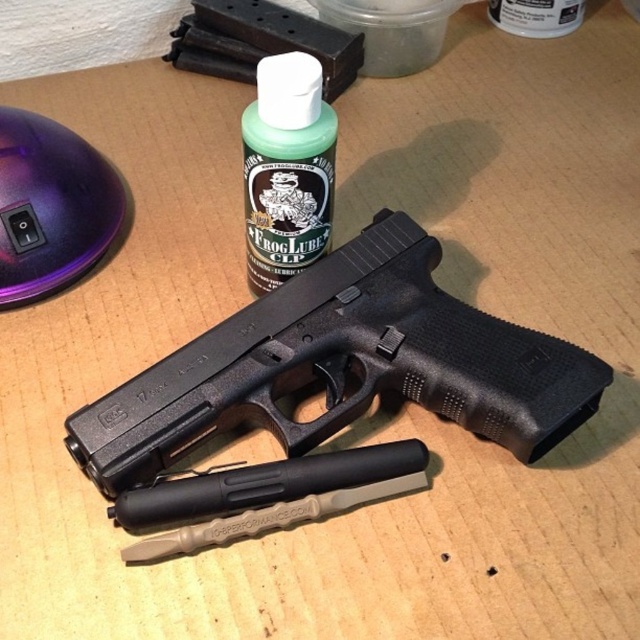
Who is taller, black matte handgun at center or purple glossy mouse at upper left?

black matte handgun at center is taller.

Which is below, black matte handgun at center or purple glossy mouse at upper left?

Positioned lower is black matte handgun at center.

Who is more forward, (220, 340) or (99, 237)?

Point (220, 340) is more forward.

Where is `black matte handgun at center`? This screenshot has height=640, width=640. black matte handgun at center is located at coordinates (344, 365).

Does purple glossy mouse at upper left have a lesser width compared to green matte bottle at center?

In fact, purple glossy mouse at upper left might be wider than green matte bottle at center.

From the picture: Who is higher up, purple glossy mouse at upper left or green matte bottle at center?

Positioned higher is green matte bottle at center.

The image size is (640, 640). What do you see at coordinates (51, 205) in the screenshot?
I see `purple glossy mouse at upper left` at bounding box center [51, 205].

Where is `purple glossy mouse at upper left`? purple glossy mouse at upper left is located at coordinates (51, 205).

Can you confirm if black matte handgun at center is thinner than green matte bottle at center?

No.

Which is more to the right, black matte handgun at center or green matte bottle at center?

Positioned to the right is black matte handgun at center.

Does point (536, 378) lie in front of point (332, 115)?

Yes, point (536, 378) is in front of point (332, 115).

This screenshot has width=640, height=640. I want to click on black matte handgun at center, so click(x=344, y=365).